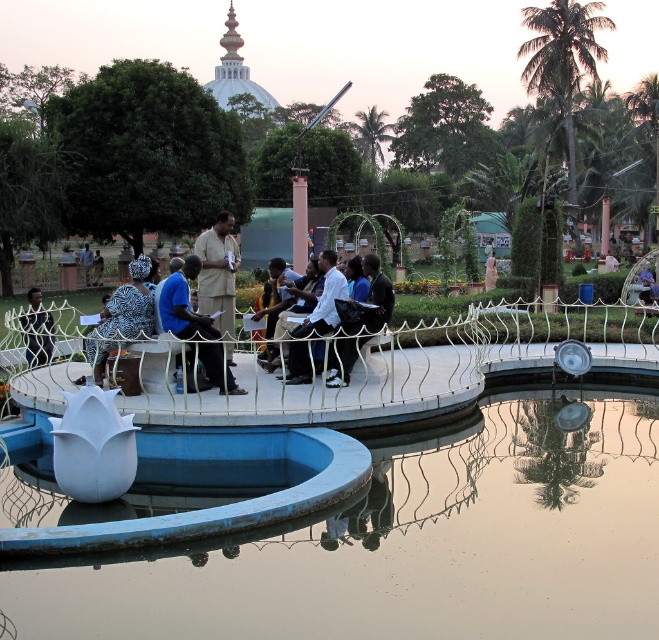
Question: Which object is closer to the camera taking this photo?

Choices:
 (A) light brown fabric shirt at center
 (B) white shirt at center

Answer: (A)

Question: Can you confirm if white glossy fountain at center is positioned above light brown fabric shirt at center?

Choices:
 (A) no
 (B) yes

Answer: (B)

Question: Can you confirm if white glossy fountain at center is wider than light brown fabric shirt at center?

Choices:
 (A) yes
 (B) no

Answer: (A)

Question: Estimate the real-world distances between objects in this image. Which object is closer to the blue fabric shirt at center?

Choices:
 (A) transparent glass water at center
 (B) light brown fabric shirt at center
 (C) dark blue fabric jacket at left

Answer: (B)

Question: Which point is closer to the camera taking this photo?

Choices:
 (A) (223, 336)
 (B) (554, 490)

Answer: (B)

Question: Where is blue fabric shirt at center located in relation to dark blue jeans at center in the image?

Choices:
 (A) right
 (B) left

Answer: (B)